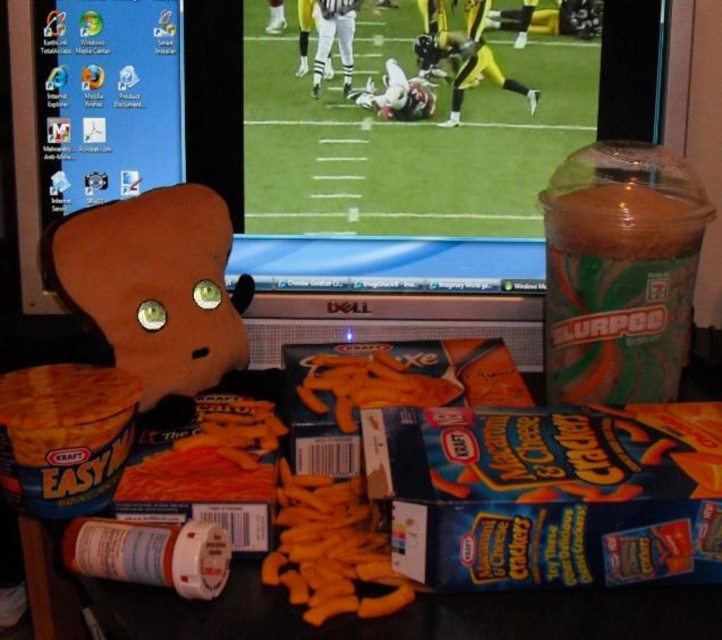
You are setting up a small snack table for a football game night. You have a brown plush toy at left and an orange matte macaroni at center. Which item is taller?

The brown plush toy at left is taller than the orange matte macaroni at center.

You are sitting at the desk and want to grab an item from point A and point B. If point A is at coordinates point (173,196) and point B is at coordinates point (287,560), which point is closer to you?

Point (173,196) is closer to you because it is further to the viewer than point (287,560).

You are a small robot with a 3.5 inch arm reach. You need to pick up the yellow matte macaroni at center from the desk. The brown plush toy at left is in the way. Can your arm reach the macaroni without moving the plush toy?

The brown plush toy at left is 9.20 inches from the yellow matte macaroni at center. Since your arm can reach 3.5 inches, you cannot reach the macaroni without moving the plush toy.